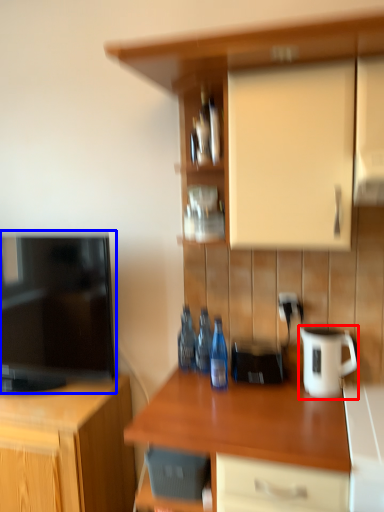
Question: Which object is closer to the camera taking this photo, jug (highlighted by a red box) or television (highlighted by a blue box)?

Choices:
 (A) jug
 (B) television

Answer: (A)